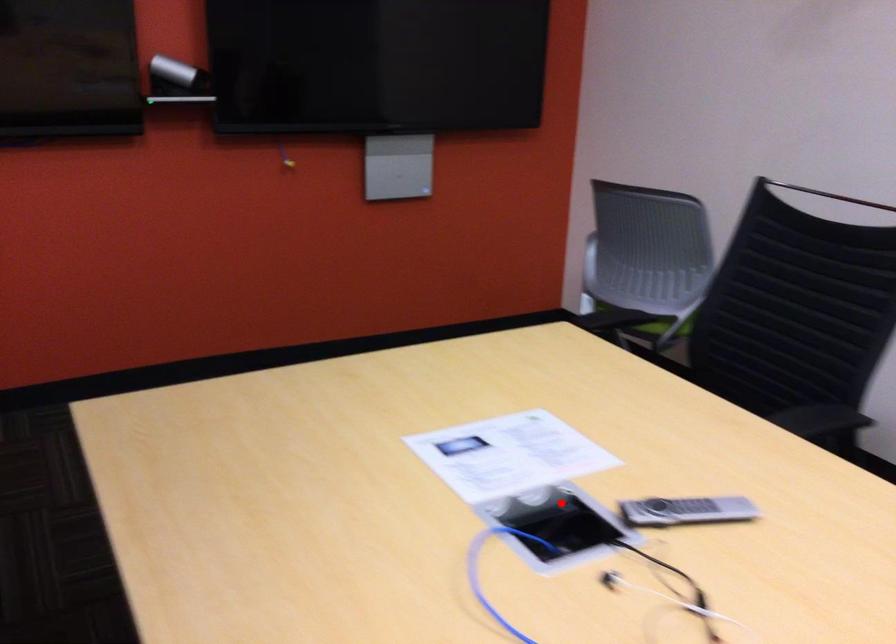
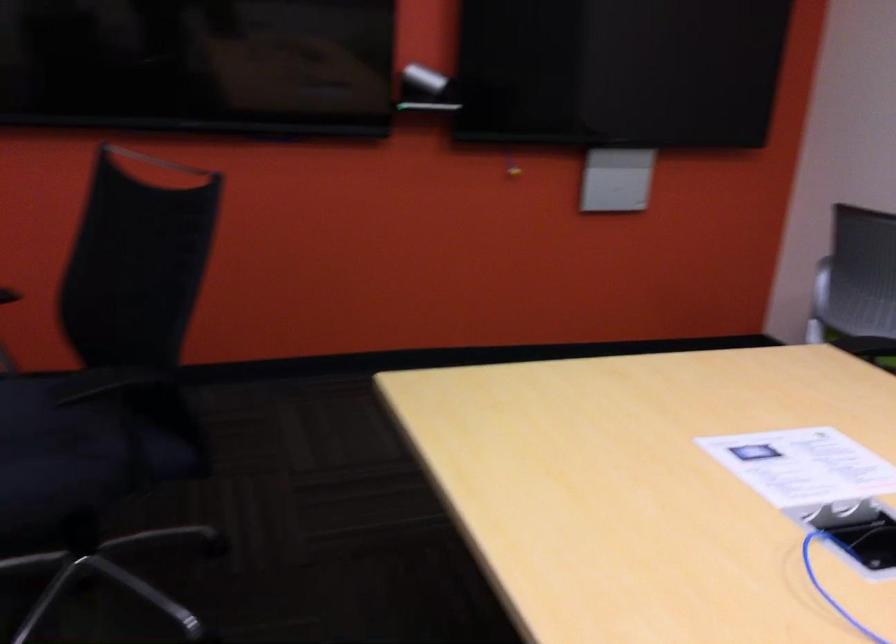
Where in the second image is the point corresponding to the highlighted location from the first image?

(858, 532)